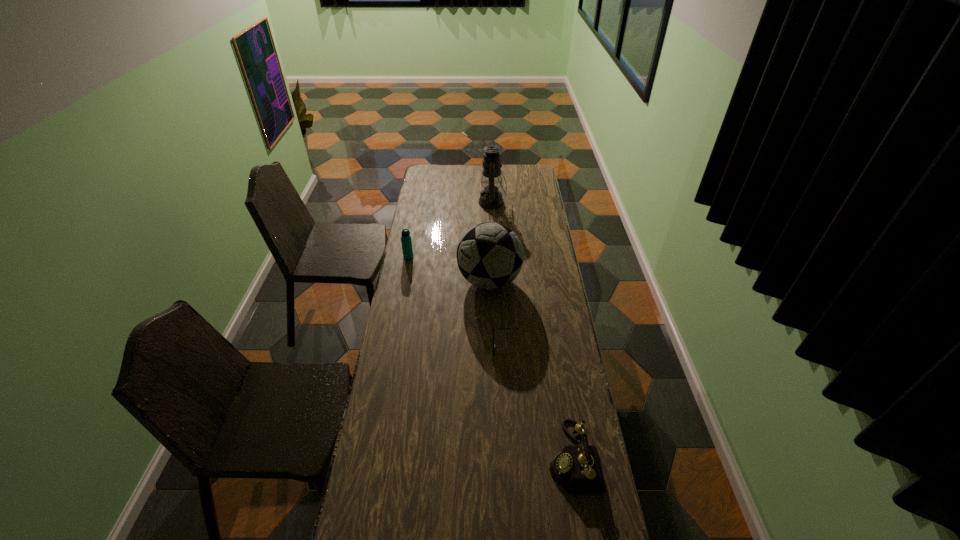
Select which object is the fourth closest to the shortest object. Please provide its 2D coordinates. Your answer should be formatted as a tuple, i.e. [(x, y)], where the tuple contains the x and y coordinates of a point satisfying the conditions above.

[(490, 198)]

Locate which object is the second closest to the shortest object. Please provide its 2D coordinates. Your answer should be formatted as a tuple, i.e. [(x, y)], where the tuple contains the x and y coordinates of a point satisfying the conditions above.

[(576, 468)]